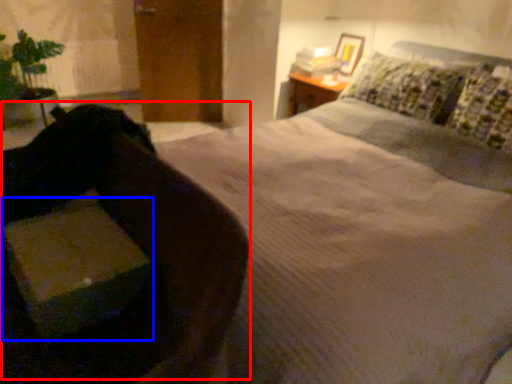
Question: Which of the following is the closest to the observer, swivel chair (highlighted by a red box) or cardboard box (highlighted by a blue box)?

Choices:
 (A) swivel chair
 (B) cardboard box

Answer: (A)